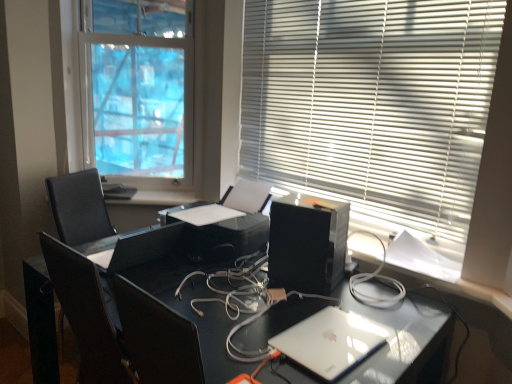
Locate an element on the screen. The height and width of the screenshot is (384, 512). vacant area located to the right-hand side of satin white laptop at lower right is located at coordinates (388, 334).